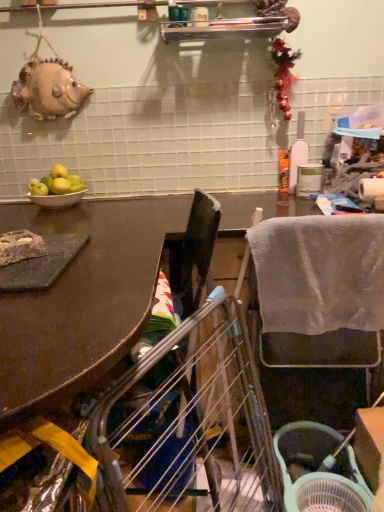
Question: Considering the positions of green plastic basket at lower right and white ceramic bowl at left in the image, is green plastic basket at lower right wider or thinner than white ceramic bowl at left?

Choices:
 (A) thin
 (B) wide

Answer: (B)

Question: In the image, is green plastic basket at lower right positioned in front of or behind white ceramic bowl at left?

Choices:
 (A) front
 (B) behind

Answer: (A)

Question: Estimate the real-world distances between objects in this image. Which object is closer to the green matte apples at left?

Choices:
 (A) matte gray stone at left
 (B) white ceramic bowl at left
 (C) green plastic basket at lower right
 (D) brown matte table at upper left
 (E) metallic silver shelf at upper center

Answer: (B)

Question: Which object is the closest to the matte gray stone at left?

Choices:
 (A) brown matte table at upper left
 (B) green plastic basket at lower right
 (C) green matte apples at left
 (D) gray fabric chair at right
 (E) white ceramic bowl at left

Answer: (A)